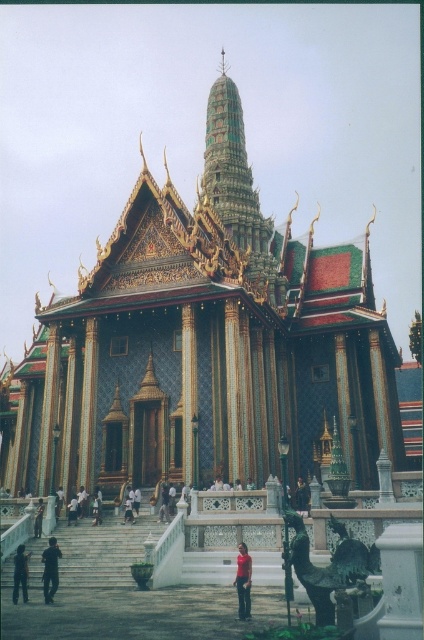
Is dark gray fabric pants at lower left above dark blue fabric at center?

No.

The width and height of the screenshot is (424, 640). I want to click on dark gray fabric pants at lower left, so click(50, 570).

Is point (47, 561) farther from camera compared to point (161, 499)?

That is False.

You are a GUI agent. You are given a task and a screenshot of the screen. Output one action in this format:
    pyautogui.click(x=<x>, y=<y>)
    Task: Click on the dark gray fabric pants at lower left
    
    Given the screenshot: What is the action you would take?
    pyautogui.click(x=50, y=570)

Between dark blue fabric at center and dark blue fabric person at lower left, which one appears on the right side from the viewer's perspective?

From the viewer's perspective, dark blue fabric at center appears more on the right side.

Is the position of dark blue fabric at center less distant than that of dark blue fabric person at lower left?

No.

What do you see at coordinates (164, 502) in the screenshot?
I see `dark blue fabric at center` at bounding box center [164, 502].

The image size is (424, 640). Identify the location of dark blue fabric at center. (164, 502).

Is dark gray fabric pants at lower left to the right of light brown wooden person at center from the viewer's perspective?

Yes, dark gray fabric pants at lower left is to the right of light brown wooden person at center.

Is dark gray fabric pants at lower left shorter than light brown wooden person at center?

Indeed, dark gray fabric pants at lower left has a lesser height compared to light brown wooden person at center.

Is point (42, 580) closer to viewer compared to point (74, 500)?

That is True.

Where is `dark gray fabric pants at lower left`? dark gray fabric pants at lower left is located at coordinates (50, 570).